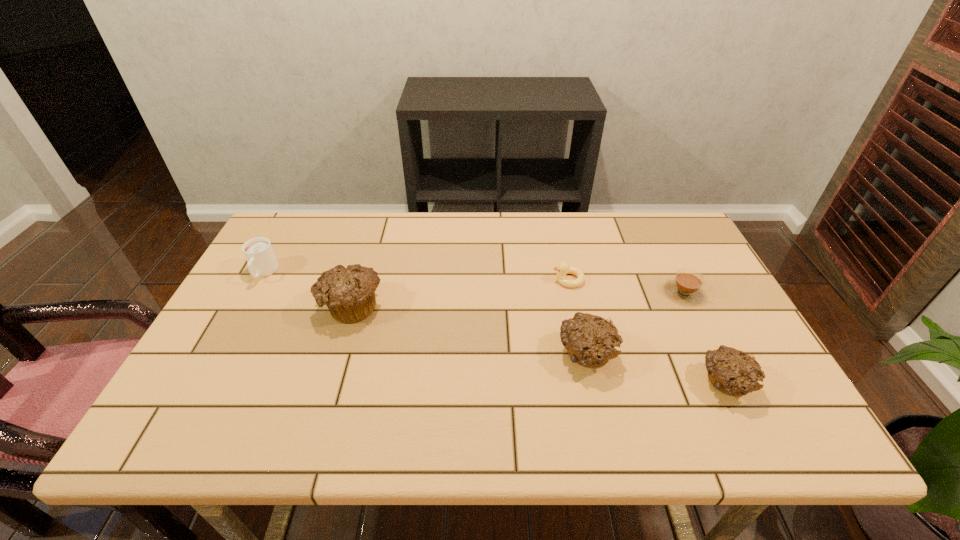
This screenshot has width=960, height=540. Identify the location of vacant space situated 0.080m on the left of the shortest muffin. (665, 383).

Identify the location of vacant area situated 0.080m on the front of the right cappuccino. (702, 329).

Image resolution: width=960 pixels, height=540 pixels. In order to click on vacant space situated at the beak of the duckling in this screenshot , I will do `click(419, 280)`.

Find the location of a particular element. This screenshot has width=960, height=540. vacant space positioned 0.170m at the beak of the duckling is located at coordinates (492, 280).

Where is `free space located at the beak of the duckling`? This screenshot has width=960, height=540. free space located at the beak of the duckling is located at coordinates (506, 280).

The image size is (960, 540). Identify the location of free region located on the side with the handle of the taller cappuccino. (215, 361).

The image size is (960, 540). I want to click on object located in the left edge section of the desktop, so click(x=262, y=262).

This screenshot has height=540, width=960. In order to click on muffin that is at the right edge in this screenshot , I will do `click(733, 372)`.

Image resolution: width=960 pixels, height=540 pixels. I want to click on cappuccino at the right edge, so 686,287.

Identify the location of object situated at the near right corner. (733, 372).